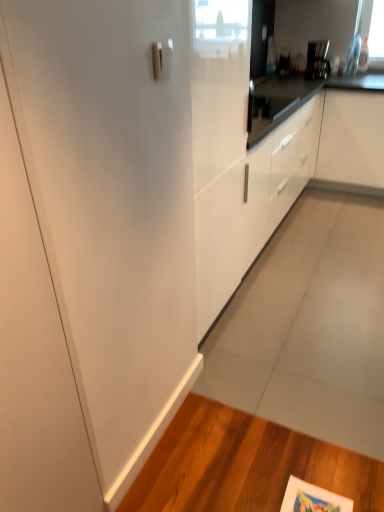
Question: From the image's perspective, is white matte cabinet at center, which is the second cabinetry in left-to-right order, on top of satin nickel door handle at upper center?

Choices:
 (A) no
 (B) yes

Answer: (B)

Question: Is white matte cabinet at center, placed as the 1th cabinetry when sorted from right to left, with satin nickel door handle at upper center?

Choices:
 (A) no
 (B) yes

Answer: (A)

Question: Does white matte cabinet at center, placed as the 1th cabinetry when sorted from right to left, come in front of satin nickel door handle at upper center?

Choices:
 (A) yes
 (B) no

Answer: (B)

Question: Is white matte cabinet at center, which is the second cabinetry in left-to-right order, looking in the opposite direction of satin nickel door handle at upper center?

Choices:
 (A) no
 (B) yes

Answer: (A)

Question: From a real-world perspective, is white matte cabinet at center, placed as the 1th cabinetry when sorted from right to left, located higher than satin nickel door handle at upper center?

Choices:
 (A) yes
 (B) no

Answer: (B)

Question: Is satin nickel door handle at upper center in front of or behind satin black coffee maker at upper right in the image?

Choices:
 (A) front
 (B) behind

Answer: (A)

Question: From a real-world perspective, relative to satin black coffee maker at upper right, is satin nickel door handle at upper center vertically above or below?

Choices:
 (A) below
 (B) above

Answer: (B)

Question: Is point (168, 71) closer or farther from the camera than point (324, 44)?

Choices:
 (A) closer
 (B) farther

Answer: (A)

Question: Is satin nickel door handle at upper center spatially inside satin black coffee maker at upper right, or outside of it?

Choices:
 (A) outside
 (B) inside

Answer: (A)

Question: Does point (168, 52) appear closer or farther from the camera than point (226, 202)?

Choices:
 (A) closer
 (B) farther

Answer: (A)

Question: Is satin nickel door handle at upper center bigger or smaller than white glossy cabinet at center, which is the first cabinetry from left to right?

Choices:
 (A) big
 (B) small

Answer: (B)

Question: Would you say satin nickel door handle at upper center is inside or outside white glossy cabinet at center, acting as the second cabinetry starting from the right?

Choices:
 (A) inside
 (B) outside

Answer: (B)

Question: From a real-world perspective, is satin nickel door handle at upper center positioned above or below white glossy cabinet at center, acting as the second cabinetry starting from the right?

Choices:
 (A) above
 (B) below

Answer: (A)

Question: From their relative heights in the image, would you say white glossy cabinet at center, which is the first cabinetry from left to right, is taller or shorter than white matte cabinet at center, which is the second cabinetry in left-to-right order?

Choices:
 (A) short
 (B) tall

Answer: (A)

Question: In the image, is white glossy cabinet at center, which is the first cabinetry from left to right, positioned in front of or behind white matte cabinet at center, placed as the 1th cabinetry when sorted from right to left?

Choices:
 (A) front
 (B) behind

Answer: (A)